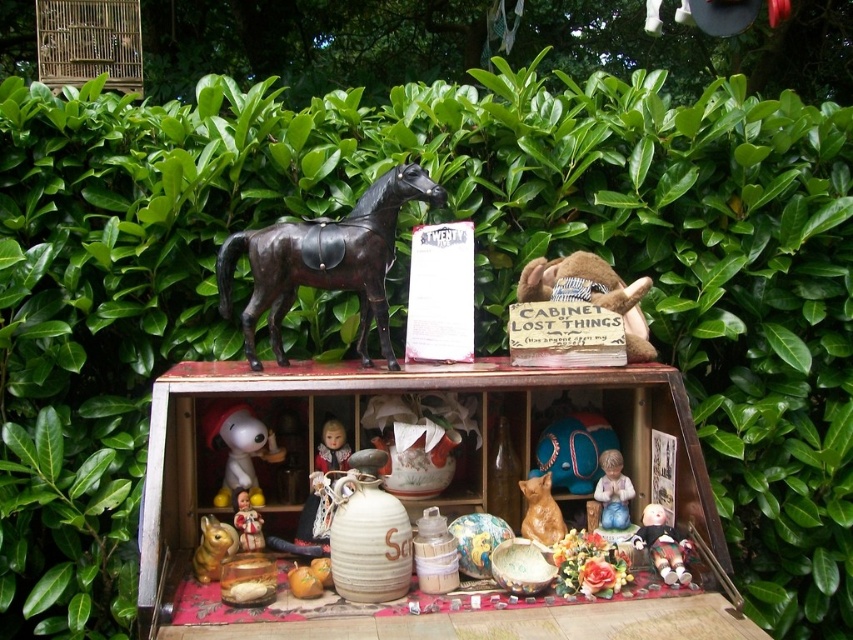
Based on the scene description, where is the shiny black horse at center located in terms of its 2D coordinates?

The shiny black horse at center is located at the 2D coordinates of point (x=325, y=260).

You are standing in front of the rustic display and want to locate the point at coordinates (x=325, y=260). Which object exactly is this point located on?

The point at coordinates (x=325, y=260) is located on the shiny black horse at center.

You are organizing a charity sale and need to place the brown plush monkey at center and the brown matte cat at center into boxes. The boxes are exactly the same size. Do you think both items will fit in their respective boxes without needing to compress them?

The brown plush monkey at center might be wider than the brown matte cat at center, so there is a possibility that the monkey may not fit in the box if the box is sized for the cat. Ensure the boxes are appropriately sized for each item.